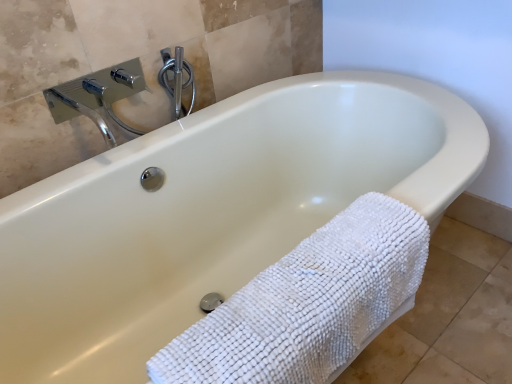
This screenshot has width=512, height=384. What do you see at coordinates (176, 78) in the screenshot?
I see `polished chrome shower at upper center` at bounding box center [176, 78].

What is the approximate height of polished chrome shower at upper center?

polished chrome shower at upper center is 6.36 inches tall.

At what (x,y) coordinates should I click in order to perform the action: click on polished chrome shower at upper center. Please return your answer as a coordinate pair (x, y). Looking at the image, I should click on (176, 78).

Measure the distance between point (343, 297) and camera.

Point (343, 297) and camera are 29.13 inches apart.

This screenshot has height=384, width=512. What do you see at coordinates (308, 303) in the screenshot?
I see `white textured towel at lower right` at bounding box center [308, 303].

The image size is (512, 384). In order to click on white textured towel at lower right in this screenshot , I will do coord(308,303).

At what (x,y) coordinates should I click in order to perform the action: click on polished chrome shower at upper center. Please return your answer as a coordinate pair (x, y). Looking at the image, I should click on (176, 78).

Considering the relative positions of white textured towel at lower right and polished chrome shower at upper center in the image provided, is white textured towel at lower right to the left or to the right of polished chrome shower at upper center?

In the image, white textured towel at lower right appears on the right side of polished chrome shower at upper center.

Which object is closer to the camera taking this photo, white textured towel at lower right or polished chrome shower at upper center?

Positioned in front is white textured towel at lower right.

Considering the positions of points (343, 305) and (179, 77), is point (343, 305) farther from camera compared to point (179, 77)?

That is False.

From the image's perspective, relative to polished chrome shower at upper center, is white textured towel at lower right above or below?

Clearly, from the image's perspective, white textured towel at lower right is below polished chrome shower at upper center.

From a real-world perspective, is white textured towel at lower right located beneath polished chrome shower at upper center?

Indeed, from a real-world perspective, white textured towel at lower right is positioned beneath polished chrome shower at upper center.

Considering the relative sizes of white textured towel at lower right and polished chrome shower at upper center in the image provided, is white textured towel at lower right wider than polished chrome shower at upper center?

Correct, the width of white textured towel at lower right exceeds that of polished chrome shower at upper center.

Considering the sizes of objects white textured towel at lower right and polished chrome shower at upper center in the image provided, who is taller, white textured towel at lower right or polished chrome shower at upper center?

With more height is white textured towel at lower right.

Between white textured towel at lower right and polished chrome shower at upper center, which one has smaller size?

polished chrome shower at upper center is smaller.

Is white textured towel at lower right located outside polished chrome shower at upper center?

white textured towel at lower right is positioned outside polished chrome shower at upper center.

Is white textured towel at lower right next to polished chrome shower at upper center?

white textured towel at lower right and polished chrome shower at upper center are not in contact.

Is polished chrome shower at upper center at the back of white textured towel at lower right?

Yes, white textured towel at lower right's orientation is away from polished chrome shower at upper center.

Where is `bath towel below the polished chrome shower at upper center (from the image's perspective)`? Image resolution: width=512 pixels, height=384 pixels. bath towel below the polished chrome shower at upper center (from the image's perspective) is located at coordinates (308, 303).

Considering the relative positions of polished chrome shower at upper center and white textured towel at lower right in the image provided, is polished chrome shower at upper center to the left or to the right of white textured towel at lower right?

From the image, it's evident that polished chrome shower at upper center is to the left of white textured towel at lower right.

Considering their positions, is polished chrome shower at upper center located in front of or behind white textured towel at lower right?

Visually, polished chrome shower at upper center is located behind white textured towel at lower right.

Is point (175, 113) more distant than point (386, 281)?

Yes.

From the image's perspective, does polished chrome shower at upper center appear lower than white textured towel at lower right?

Actually, polished chrome shower at upper center appears above white textured towel at lower right in the image.

From a real-world perspective, does polished chrome shower at upper center sit lower than white textured towel at lower right?

Incorrect, from a real-world perspective, polished chrome shower at upper center is higher than white textured towel at lower right.

Which of these two, polished chrome shower at upper center or white textured towel at lower right, is wider?

With larger width is white textured towel at lower right.

From their relative heights in the image, would you say polished chrome shower at upper center is taller or shorter than white textured towel at lower right?

polished chrome shower at upper center is shorter than white textured towel at lower right.

Does polished chrome shower at upper center have a larger size compared to white textured towel at lower right?

Actually, polished chrome shower at upper center might be smaller than white textured towel at lower right.

Is polished chrome shower at upper center spatially inside white textured towel at lower right, or outside of it?

polished chrome shower at upper center exists outside the volume of white textured towel at lower right.

Is polished chrome shower at upper center directly adjacent to white textured towel at lower right?

polished chrome shower at upper center and white textured towel at lower right are not in contact.

Is polished chrome shower at upper center aimed at white textured towel at lower right?

No, polished chrome shower at upper center is not facing towards white textured towel at lower right.

How different are the orientations of polished chrome shower at upper center and white textured towel at lower right in degrees?

The facing directions of polished chrome shower at upper center and white textured towel at lower right are 0.068 degrees apart.

Looking at this image, measure the distance between polished chrome shower at upper center and white textured towel at lower right.

polished chrome shower at upper center is 34.16 inches away from white textured towel at lower right.

The image size is (512, 384). Find the location of `bath towel below the polished chrome shower at upper center (from the image's perspective)`. bath towel below the polished chrome shower at upper center (from the image's perspective) is located at coordinates (308, 303).

Identify the location of bath towel in front of the polished chrome shower at upper center. (308, 303).

Identify the location of bath towel below the polished chrome shower at upper center (from the image's perspective). This screenshot has height=384, width=512. (308, 303).